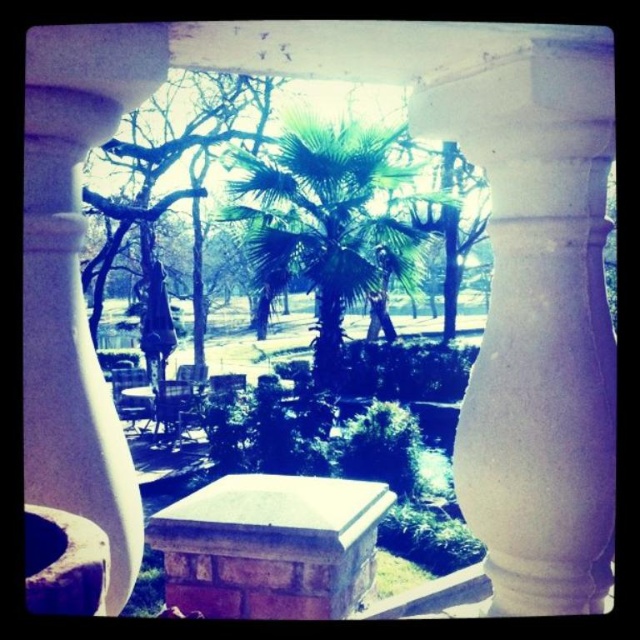
You are standing in front of the doorway and see the point marked at coordinate (326, 227). What object is located at that point?

The point at coordinate (326, 227) marks the green leafy palm tree at center.

You are standing in front of the doorway and want to take a photo of the white smooth pillar at center. To ensure it is centered in your photo, where should you position the pillar relative to the frame?

The white smooth pillar at center is already positioned at the center of the frame at coordinates point (538, 321), so you should keep it there to ensure it remains centered in your photo.

You are standing in a room and looking through an open doorway. You see two white pillars at the center. Which pillar is positioned lower in your view, the white smooth pillar at center or the white stone pillar at center?

The white smooth pillar at center is positioned lower in your view because it is below the white stone pillar at center.